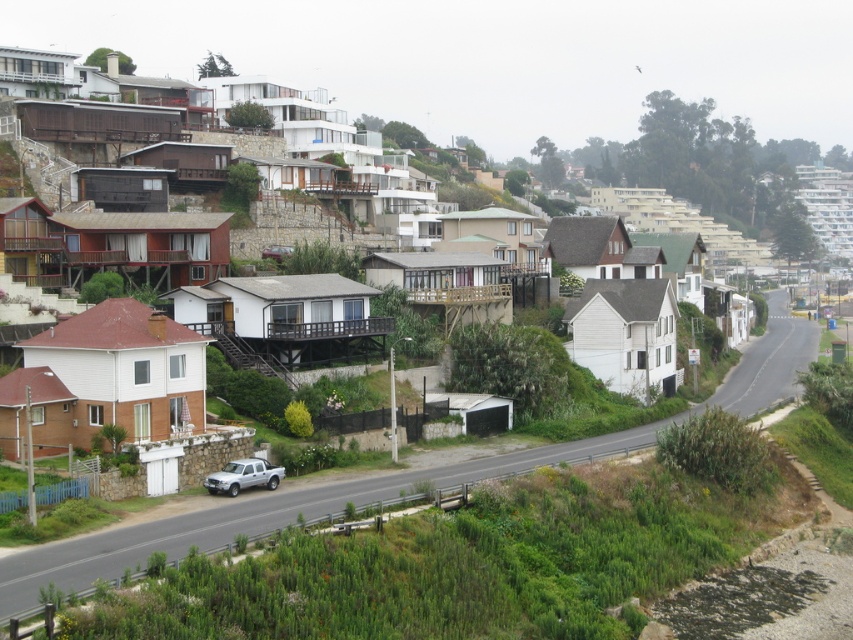
You are standing at the point marked as point (119, 120) in the image. Which house is directly in front of you?

The white matte house at center is located at point (119, 120), so the house directly in front of you is the white matte house at center.

You are a delivery driver approaching the residential area. You need to park the silver metallic pickup truck at center near the white matte house at center. Given the size difference between them, will the truck fit in the driveway of the house?

The white matte house at center is larger in size than the silver metallic pickup truck at center, so the driveway of the white matte house at center should be spacious enough to accommodate the silver metallic pickup truck at center.

You are a delivery driver who needs to park your metallic maroon car at center as close as possible to the white matte house at center without blocking the road. The road is narrow and only allows parking 10 meters away from any house. Can you park your car within the allowed distance?

The white matte house at center is 21.75 meters away from the metallic maroon car at center. Since the parking rule requires vehicles to be at least 10 meters away from any house, the car is already parked beyond the minimum distance requirement. Therefore, you can park the metallic maroon car at center within the allowed distance as it is 21.75 meters away from the white matte house at center, which exceeds the 10 meters requirement.